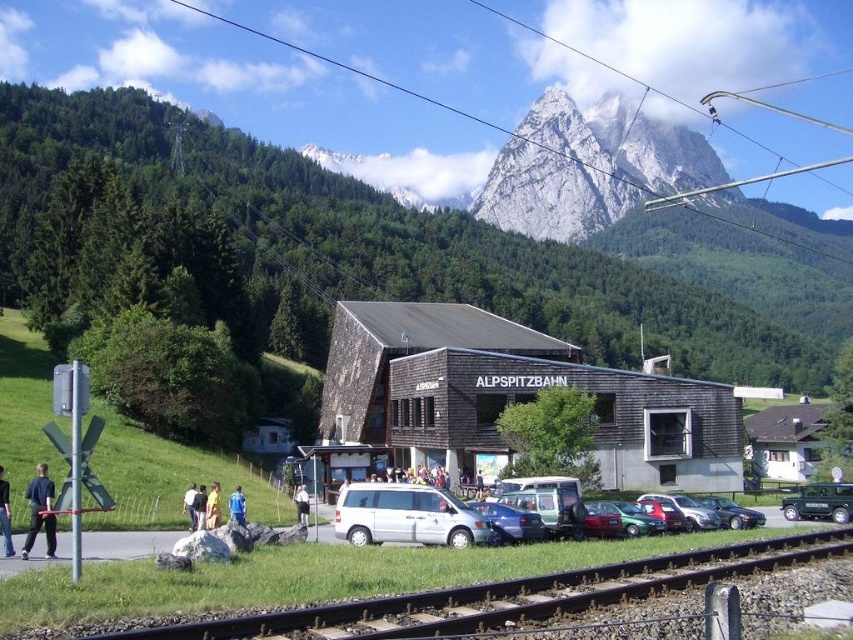
Question: Observing the image, what is the correct spatial positioning of metallic blue sedan at center in reference to blue jeans at lower center?

Choices:
 (A) below
 (B) above

Answer: (B)

Question: Which point is farther to the camera?

Choices:
 (A) coord(183,502)
 (B) coord(619,518)
 (C) coord(210,634)

Answer: (A)

Question: Where is black asphalt train track at lower center located in relation to metallic blue sedan at center in the image?

Choices:
 (A) left
 (B) right

Answer: (B)

Question: Among these objects, which one is nearest to the camera?

Choices:
 (A) black asphalt train track at lower center
 (B) black fabric pants at lower left

Answer: (A)

Question: Does yellow fabric at lower center have a lesser width compared to light brown leather jacket at lower center?

Choices:
 (A) yes
 (B) no

Answer: (A)

Question: Among these points, which one is farthest from the camera?

Choices:
 (A) pyautogui.click(x=190, y=509)
 (B) pyautogui.click(x=201, y=486)
 (C) pyautogui.click(x=27, y=552)

Answer: (B)